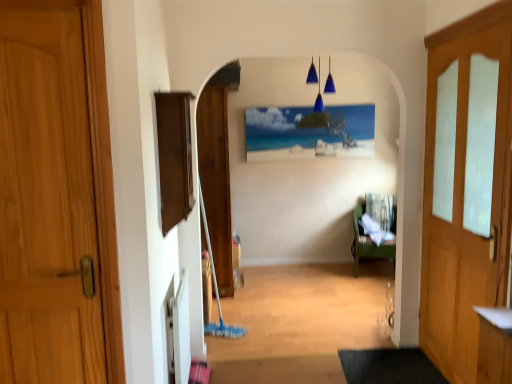
Measure the distance between point (312, 80) and camera.

Point (312, 80) and camera are 4.54 meters apart.

This screenshot has height=384, width=512. In order to click on blue glass pendant lights at upper center in this screenshot , I will do `click(319, 87)`.

Where is `green wicker chair at center-right`? The image size is (512, 384). green wicker chair at center-right is located at coordinates (367, 244).

What do you see at coordinates (466, 185) in the screenshot? The height and width of the screenshot is (384, 512). I see `wooden door at right, the 2th door viewed from the back` at bounding box center [466, 185].

Identify the location of wooden door at left, the first door when ordered from left to right. The height and width of the screenshot is (384, 512). (49, 181).

From the picture: Is wooden door at right, which ranks as the second door in front-to-back order, taller or shorter than wooden door at left, which is the third door from back to front?

Clearly, wooden door at right, which ranks as the second door in front-to-back order, is taller compared to wooden door at left, which is the third door from back to front.

In the image, is wooden door at right, the third door viewed from the left, positioned in front of or behind wooden door at left, the 3th door when ordered from right to left?

wooden door at right, the third door viewed from the left, is positioned farther from the viewer than wooden door at left, the 3th door when ordered from right to left.

Considering the positions of point (475, 260) and point (65, 168), is point (475, 260) closer or farther from the camera than point (65, 168)?

Point (475, 260) is positioned farther from the camera compared to point (65, 168).

Is wooden door at right, which ranks as the second door in front-to-back order, to the right of wooden door at left, which ranks as the first door in front-to-back order, from the viewer's perspective?

Yes, wooden door at right, which ranks as the second door in front-to-back order, is to the right of wooden door at left, which ranks as the first door in front-to-back order.

How different are the orientations of dark gray rubber doormat at lower center and matte canvas painting at center in degrees?

There is a 92.2-degree angle between the facing directions of dark gray rubber doormat at lower center and matte canvas painting at center.

Choose the correct answer: Is dark gray rubber doormat at lower center inside matte canvas painting at center or outside it?

dark gray rubber doormat at lower center is not inside matte canvas painting at center, it's outside.

From the image's perspective, is dark gray rubber doormat at lower center on top of matte canvas painting at center?

Incorrect, from the image's perspective, dark gray rubber doormat at lower center is lower than matte canvas painting at center.

Is dark gray rubber doormat at lower center smaller than matte canvas painting at center?

Yes, dark gray rubber doormat at lower center is smaller than matte canvas painting at center.

Which is correct: dark gray rubber doormat at lower center is inside green wicker chair at center-right, or outside of it?

The correct answer is: outside.

Is point (436, 372) less distant than point (359, 252)?

Yes, it is.

Is dark gray rubber doormat at lower center behind green wicker chair at center-right?

No, it is not.

Is there a large distance between dark gray rubber doormat at lower center and green wicker chair at center-right?

That's right, there is a large distance between dark gray rubber doormat at lower center and green wicker chair at center-right.

Is green wicker chair at center-right directly adjacent to wooden door at left, the 3th door when ordered from right to left?

No, green wicker chair at center-right is not in contact with wooden door at left, the 3th door when ordered from right to left.

Is green wicker chair at center-right oriented away from wooden door at left, the first door when ordered from left to right?

No.

Is blue glass pendant lights at upper center at the right side of green wicker chair at center-right?

In fact, blue glass pendant lights at upper center is to the left of green wicker chair at center-right.

Is point (333, 83) positioned in front of point (361, 247)?

That is False.

Which of these two, blue glass pendant lights at upper center or green wicker chair at center-right, is thinner?

blue glass pendant lights at upper center is thinner.

Considering the sizes of objects blue glass pendant lights at upper center and matte canvas painting at center in the image provided, who is shorter, blue glass pendant lights at upper center or matte canvas painting at center?

With less height is blue glass pendant lights at upper center.

From the image's perspective, which is below, blue glass pendant lights at upper center or matte canvas painting at center?

From the image's view, matte canvas painting at center is below.

What's the angular difference between blue glass pendant lights at upper center and matte canvas painting at center's facing directions?

The facing directions of blue glass pendant lights at upper center and matte canvas painting at center are 2.82 degrees apart.

Is blue glass pendant lights at upper center inside or outside of matte canvas painting at center?

blue glass pendant lights at upper center is located beyond the bounds of matte canvas painting at center.

Considering the sizes of objects wooden door at center, which ranks as the second door in left-to-right order, and dark gray rubber doormat at lower center in the image provided, who is bigger, wooden door at center, which ranks as the second door in left-to-right order, or dark gray rubber doormat at lower center?

Bigger between the two is wooden door at center, which ranks as the second door in left-to-right order.

How many degrees apart are the facing directions of wooden door at center, which appears as the 3th door when viewed from the front, and dark gray rubber doormat at lower center?

176 degrees separate the facing orientations of wooden door at center, which appears as the 3th door when viewed from the front, and dark gray rubber doormat at lower center.

Identify the location of the 1st door to the left of the dark gray rubber doormat at lower center, counting from the anchor's position. This screenshot has width=512, height=384. (216, 180).

From a real-world perspective, is wooden door at center, which ranks as the second door in left-to-right order, on dark gray rubber doormat at lower center?

Answer: Indeed, from a real-world perspective, wooden door at center, which ranks as the second door in left-to-right order, stands above dark gray rubber doormat at lower center.

From the image's perspective, which door is the 1st one above the wooden door at right, which is counted as the first door, starting from the right? Please provide its 2D coordinates.

[(49, 181)]

There is a dark gray rubber doormat at lower center. Where is `picture frame above it (from a real-world perspective)`? The width and height of the screenshot is (512, 384). picture frame above it (from a real-world perspective) is located at coordinates (309, 132).

Looking at the image, which one is located closer to wooden door at center, which ranks as the second door in left-to-right order, blue glass pendant lights at upper center or matte canvas painting at center?

matte canvas painting at center lies closer to wooden door at center, which ranks as the second door in left-to-right order, than the other object.

Looking at this image, which object lies nearer to the anchor point wooden door at center, which ranks as the second door in left-to-right order, wooden door at left, which is the third door from back to front, or green wicker chair at center-right?

green wicker chair at center-right is positioned closer to the anchor wooden door at center, which ranks as the second door in left-to-right order.

From the image, which object appears to be farther from green wicker chair at center-right, wooden door at right, which is counted as the first door, starting from the right, or blue glass pendant lights at upper center?

wooden door at right, which is counted as the first door, starting from the right, lies further to green wicker chair at center-right than the other object.

Considering their positions, is matte canvas painting at center positioned closer to wooden door at left, which is the third door from back to front, than wooden door at center, the 1th door positioned from the back?

wooden door at center, the 1th door positioned from the back, lies closer to wooden door at left, which is the third door from back to front, than the other object.

From the image, which object appears to be nearer to wooden door at center, which is counted as the second door, starting from the right, green wicker chair at center-right or dark gray rubber doormat at lower center?

dark gray rubber doormat at lower center is positioned closer to the anchor wooden door at center, which is counted as the second door, starting from the right.

Considering their positions, is wooden door at center, which appears as the 3th door when viewed from the front, positioned further to wooden door at left, the first door when ordered from left to right, than blue glass pendant lights at upper center?

blue glass pendant lights at upper center.

Which object lies nearer to the anchor point matte canvas painting at center, wooden door at center, which is counted as the second door, starting from the right, or wooden door at right, which is counted as the first door, starting from the right?

The object closer to matte canvas painting at center is wooden door at center, which is counted as the second door, starting from the right.

Which object lies nearer to the anchor point matte canvas painting at center, green wicker chair at center-right or wooden door at right, which ranks as the second door in front-to-back order?

Among the two, green wicker chair at center-right is located nearer to matte canvas painting at center.

This screenshot has height=384, width=512. Find the location of `doormat located between wooden door at center, the 1th door positioned from the back, and green wicker chair at center-right in the left-right direction`. doormat located between wooden door at center, the 1th door positioned from the back, and green wicker chair at center-right in the left-right direction is located at coordinates (389, 367).

At what (x,y) coordinates should I click in order to perform the action: click on doormat between wooden door at right, the 2th door viewed from the back, and wooden door at center, the 1th door positioned from the back, from front to back. Please return your answer as a coordinate pair (x, y). Looking at the image, I should click on (389, 367).

In order to click on door between dark gray rubber doormat at lower center and matte canvas painting at center along the z-axis in this screenshot , I will do `click(216, 180)`.

What are the coordinates of `lamp between wooden door at center, the 1th door positioned from the back, and matte canvas painting at center, in the horizontal direction` in the screenshot? It's located at (319, 87).